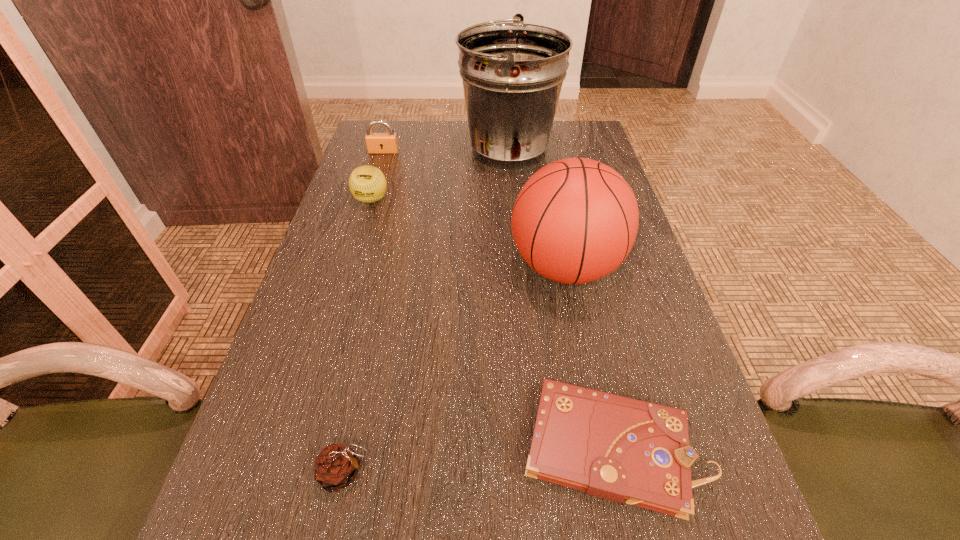
Locate an element on the screen. free spot that satisfies the following two spatial constraints: 1. on the logo side of the notebook; 2. on the right side of the softball is located at coordinates (298, 447).